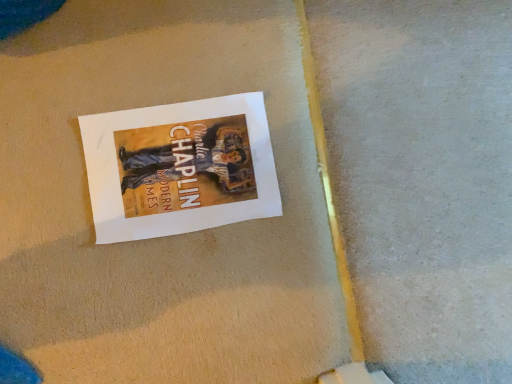
Measure the distance between point (x=139, y=183) and camera.

The distance of point (x=139, y=183) from camera is 26.93 inches.

The width and height of the screenshot is (512, 384). Describe the element at coordinates (179, 167) in the screenshot. I see `matte paper poster at center` at that location.

Identify the location of matte paper poster at center. (179, 167).

Measure the distance between matte paper poster at center and camera.

matte paper poster at center is 26.62 inches from camera.

I want to click on matte paper poster at center, so click(179, 167).